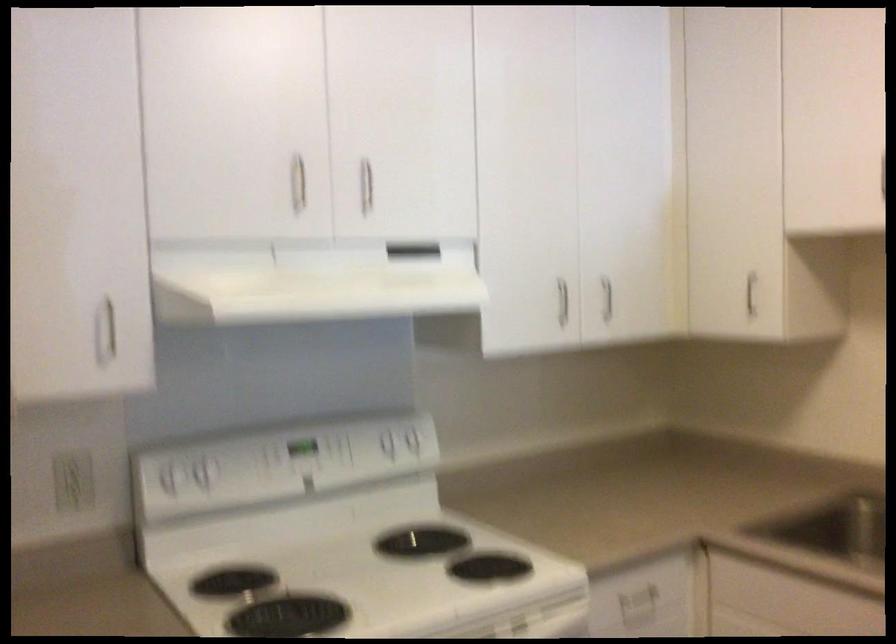
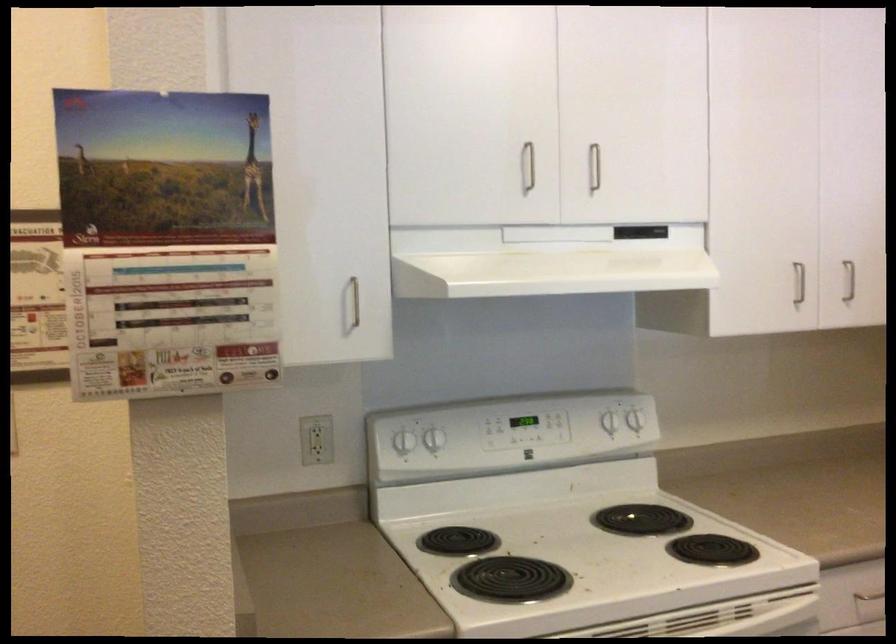
Locate, in the second image, the point that corresponds to [205,473] in the first image.

(435, 439)